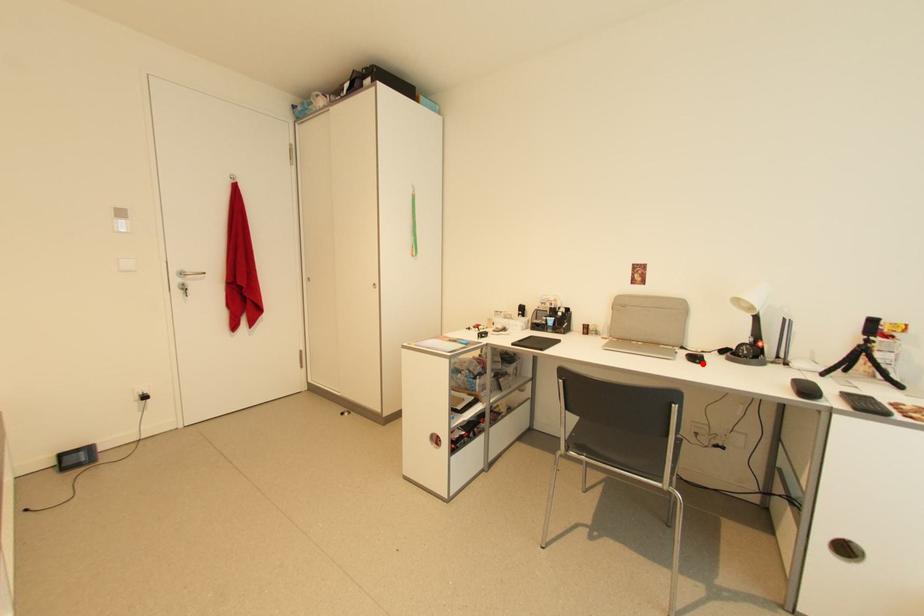
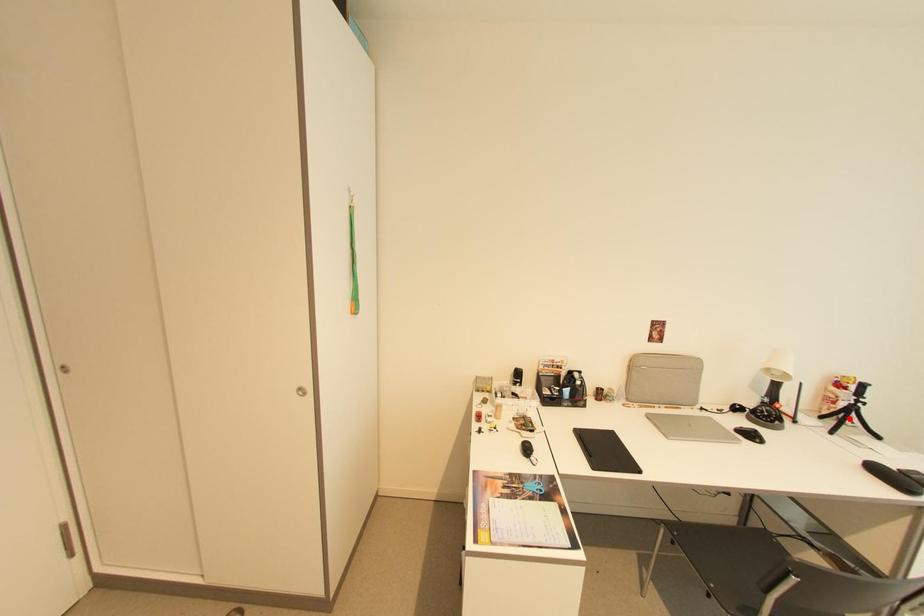
I am providing you with two images of the same scene from different viewpoints. A red point is marked on the first image and another point is marked on the second image. Is the marked point in image1 the same physical position as the marked point in image2?

No